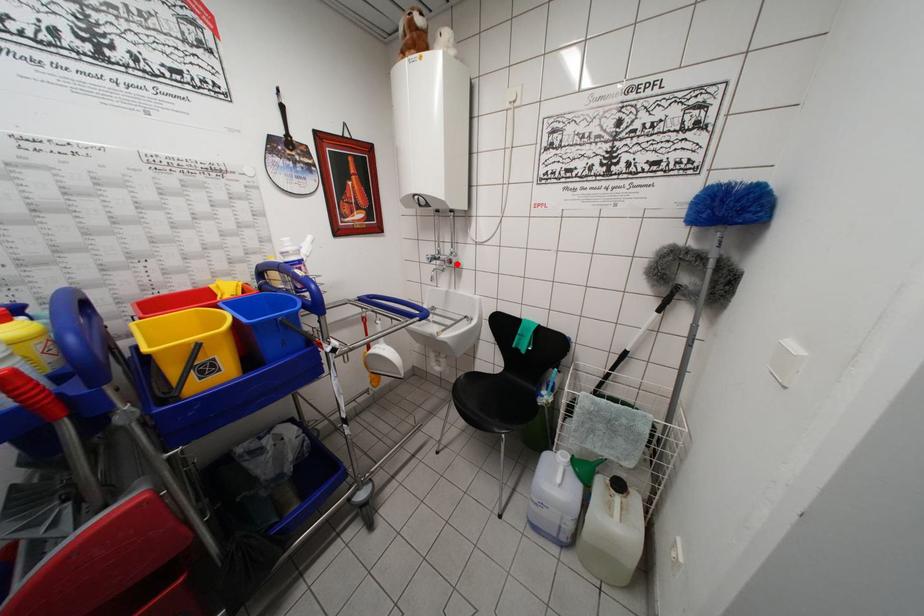
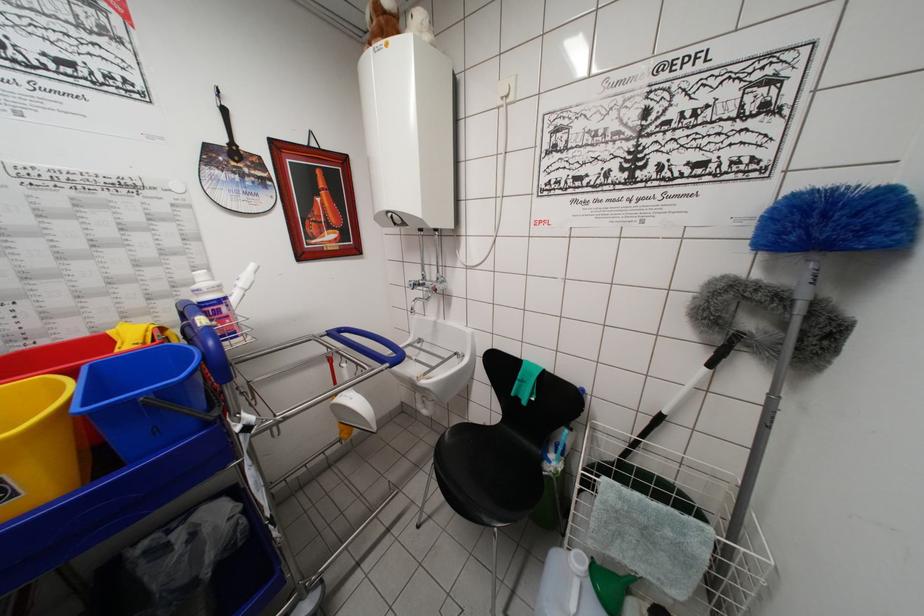
In the second image, find the point that corresponds to the highlighted location in the first image.

(443, 292)